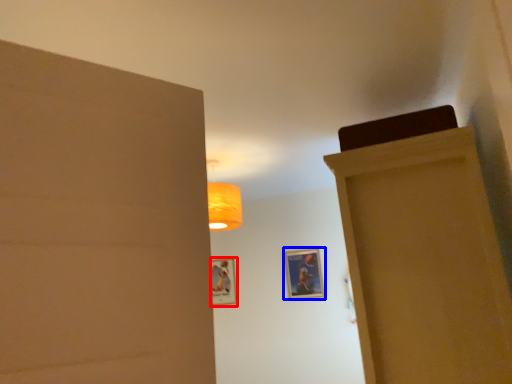
Question: Which of the following is the closest to the observer, picture frame (highlighted by a red box) or picture frame (highlighted by a blue box)?

Choices:
 (A) picture frame
 (B) picture frame

Answer: (B)